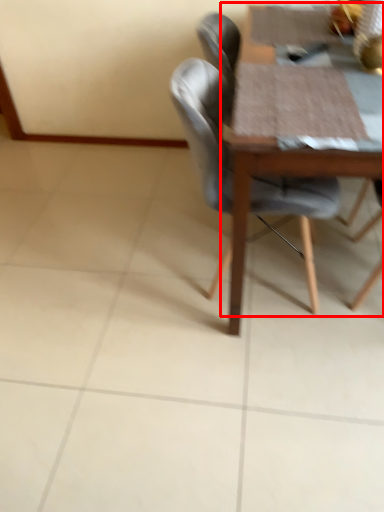
Question: Where is round table (annotated by the red box) located in relation to chair in the image?

Choices:
 (A) left
 (B) right

Answer: (B)